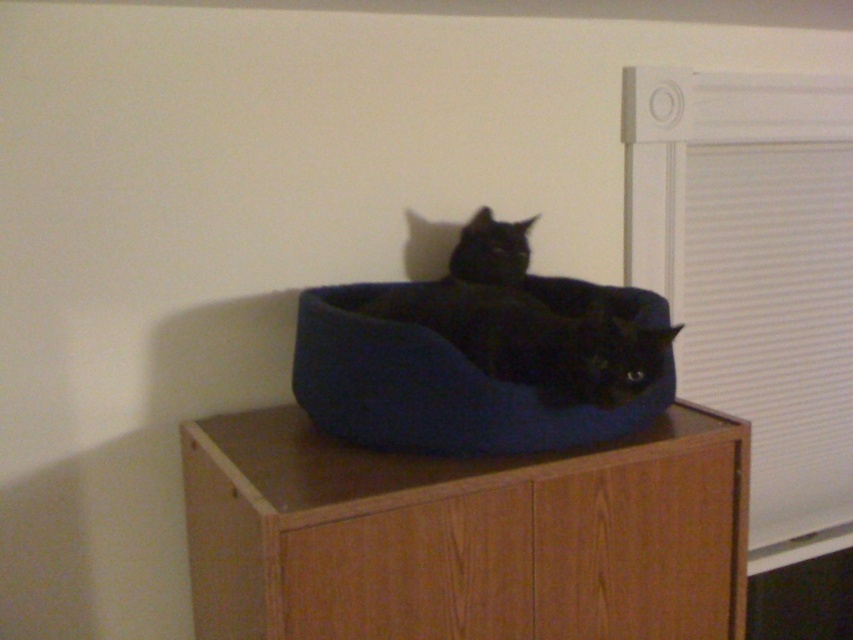
Can you confirm if blue plush cat bed at center is wider than black soft cushion at center?

Correct, the width of blue plush cat bed at center exceeds that of black soft cushion at center.

Who is more distant from viewer, (515, 420) or (544, 308)?

Point (544, 308)

Where is `blue plush cat bed at center`? This screenshot has width=853, height=640. blue plush cat bed at center is located at coordinates (438, 387).

In order to click on blue plush cat bed at center in this screenshot , I will do `click(438, 387)`.

In the scene shown: Does wooden dresser at center have a lesser height compared to black soft cushion at center?

No, wooden dresser at center is not shorter than black soft cushion at center.

Is the position of wooden dresser at center less distant than that of black soft cushion at center?

Yes, it is in front of black soft cushion at center.

Between point (196, 468) and point (473, 243), which one is positioned in front?

Point (196, 468) is in front.

The image size is (853, 640). I want to click on wooden dresser at center, so click(x=463, y=536).

Which is in front, point (700, 259) or point (554, 353)?

Positioned in front is point (554, 353).

Does point (849, 266) come in front of point (431, 310)?

No, (849, 266) is further to viewer.

Identify the location of white fabric blinds at right. (770, 316).